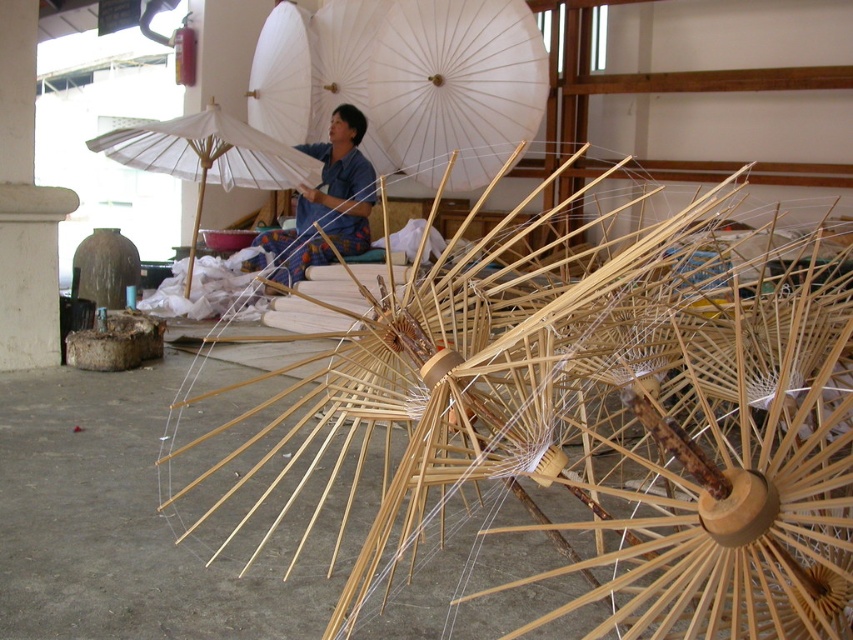
Consider the image. You are standing in the workshop and want to pick up an object located at point (438, 45). Can you reach it without moving your feet?

The point (438, 45) is 4.42 meters away from the viewer, so you cannot reach it without moving your feet.

What is located at the point with coordinates (207, 156) in the image?

The point with coordinates (207, 156) corresponds to the white paper umbrella at upper center.